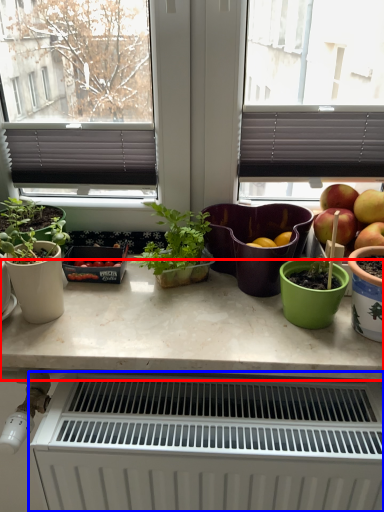
Question: Which of the following is the farthest to the observer, countertop (highlighted by a red box) or radiator (highlighted by a blue box)?

Choices:
 (A) countertop
 (B) radiator

Answer: (A)